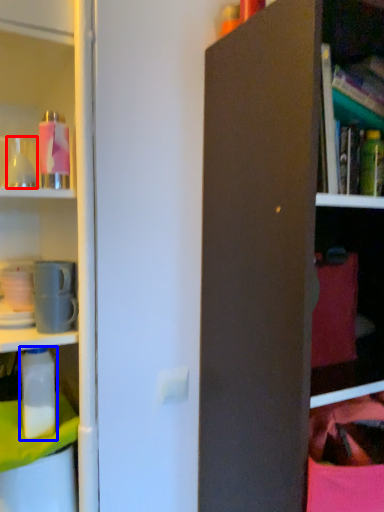
Question: Which point is closer to the camera, bottle (highlighted by a red box) or bottle (highlighted by a blue box)?

Choices:
 (A) bottle
 (B) bottle

Answer: (A)